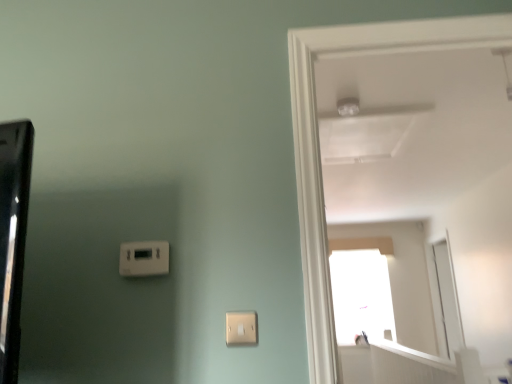
Question: From a real-world perspective, is white plastic thermostat at lower left, marked as the first light switch in a back-to-front arrangement, physically above white plastic light switch at lower center, the 2th light switch positioned from the back?

Choices:
 (A) no
 (B) yes

Answer: (B)

Question: Considering the relative positions of white plastic thermostat at lower left, placed as the first light switch when sorted from top to bottom, and white plastic light switch at lower center, positioned as the second light switch in top-to-bottom order, in the image provided, is white plastic thermostat at lower left, placed as the first light switch when sorted from top to bottom, behind white plastic light switch at lower center, positioned as the second light switch in top-to-bottom order,?

Choices:
 (A) no
 (B) yes

Answer: (B)

Question: Is white plastic thermostat at lower left, marked as the first light switch in a back-to-front arrangement, not inside white plastic light switch at lower center, which is the 1th light switch from front to back?

Choices:
 (A) no
 (B) yes

Answer: (B)

Question: Is white plastic thermostat at lower left, marked as the first light switch in a back-to-front arrangement, to the right of white plastic light switch at lower center, the first light switch viewed from the right, from the viewer's perspective?

Choices:
 (A) yes
 (B) no

Answer: (B)

Question: Is the position of white plastic thermostat at lower left, which is the first light switch in left-to-right order, less distant than that of white plastic light switch at lower center, the 2th light switch positioned from the back?

Choices:
 (A) no
 (B) yes

Answer: (A)

Question: From the image's perspective, does white plastic thermostat at lower left, which is the 2th light switch in bottom-to-top order, appear lower than white plastic light switch at lower center, the first light switch viewed from the right?

Choices:
 (A) no
 (B) yes

Answer: (A)

Question: Is white plastic thermostat at lower left, which is the first light switch in left-to-right order, aimed at white glossy door at upper right?

Choices:
 (A) yes
 (B) no

Answer: (B)

Question: Would you say white plastic thermostat at lower left, marked as the first light switch in a back-to-front arrangement, is outside white glossy door at upper right?

Choices:
 (A) no
 (B) yes

Answer: (B)

Question: Is white plastic thermostat at lower left, which is the 2th light switch in bottom-to-top order, closer to camera compared to white glossy door at upper right?

Choices:
 (A) yes
 (B) no

Answer: (B)

Question: From the image's perspective, would you say white plastic thermostat at lower left, placed as the first light switch when sorted from top to bottom, is positioned over white glossy door at upper right?

Choices:
 (A) no
 (B) yes

Answer: (A)

Question: Can you confirm if white plastic thermostat at lower left, which is the first light switch in left-to-right order, is thinner than white glossy door at upper right?

Choices:
 (A) no
 (B) yes

Answer: (B)

Question: Is white plastic thermostat at lower left, marked as the first light switch in a back-to-front arrangement, positioned behind white glossy door at upper right?

Choices:
 (A) no
 (B) yes

Answer: (B)

Question: Is white glossy door at upper right bigger than white plastic light switch at lower center, the second light switch when ordered from left to right?

Choices:
 (A) no
 (B) yes

Answer: (B)